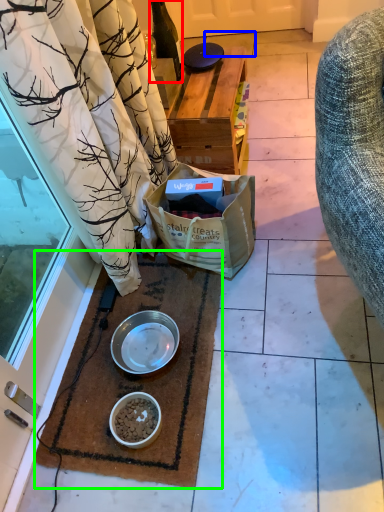
Question: Considering the real-world distances, which object is farthest from bottle (highlighted by a red box)? tile (highlighted by a blue box) or mat (highlighted by a green box)?

Choices:
 (A) tile
 (B) mat

Answer: (A)